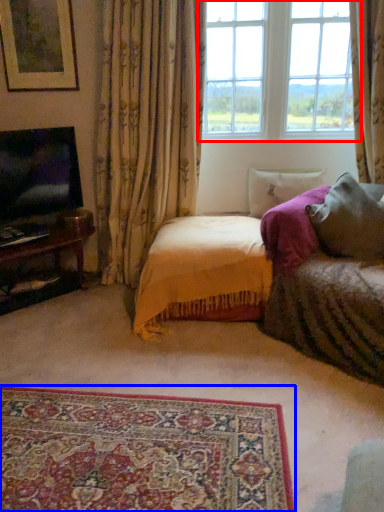
Question: Which object is further to the camera taking this photo, window (highlighted by a red box) or plain (highlighted by a blue box)?

Choices:
 (A) window
 (B) plain

Answer: (A)